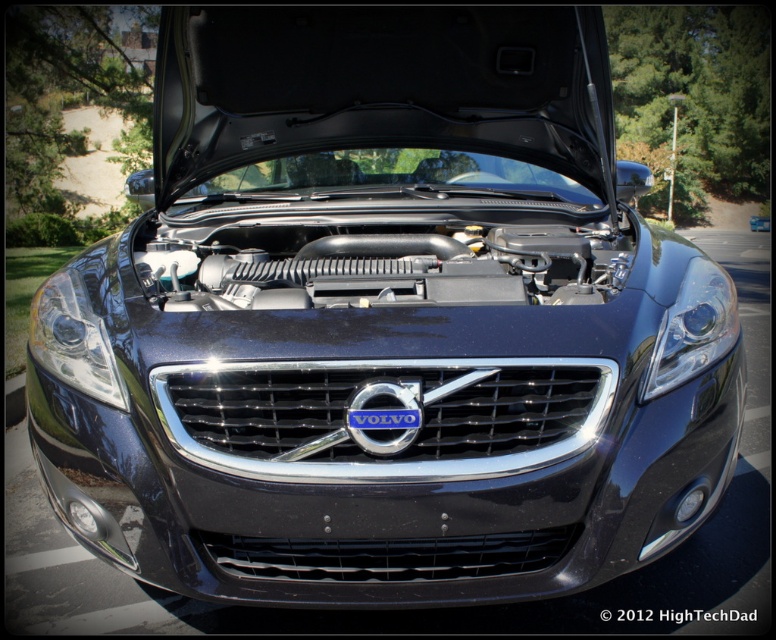
You are a car mechanic inspecting the front of the Volvo. You notice the satin black headlight at center and the blue metallic volvo emblem at center. Which object has a bigger size?

The satin black headlight at center is larger in size than the blue metallic volvo emblem at center.

You are a mechanic inspecting the front of the Volvo car. You need to locate the satin black headlight at center and the blue metallic volvo emblem at center. Which object is positioned to the left of the other?

The satin black headlight at center is to the left of the blue metallic volvo emblem at center.